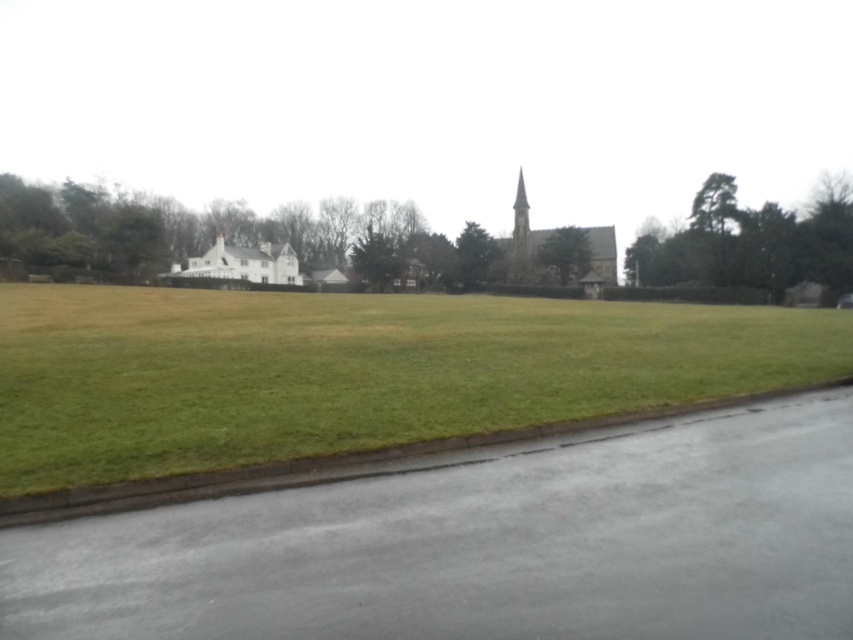
Is smooth stone church at center shorter than smooth stone spire at center?

No.

Consider the image. Is smooth stone church at center closer to the viewer compared to smooth stone spire at center?

Yes, it is in front of smooth stone spire at center.

Does point (515, 211) come behind point (517, 264)?

That is True.

Identify the location of smooth stone church at center. The image size is (853, 640). (521, 237).

Is green grass at center shorter than smooth stone spire at center?

Yes, green grass at center is shorter than smooth stone spire at center.

In the scene shown: Can you confirm if green grass at center is smaller than smooth stone spire at center?

Yes.

At what (x,y) coordinates should I click in order to perform the action: click on green grass at center. Please return your answer as a coordinate pair (x, y). Looking at the image, I should click on (352, 371).

Does green grass at center come in front of white matte house at center?

That is True.

Does green grass at center have a larger size compared to white matte house at center?

No.

What do you see at coordinates (352, 371) in the screenshot?
I see `green grass at center` at bounding box center [352, 371].

You are a GUI agent. You are given a task and a screenshot of the screen. Output one action in this format:
    pyautogui.click(x=<x>, y=<y>)
    Task: Click on the green grass at center
    
    Given the screenshot: What is the action you would take?
    pyautogui.click(x=352, y=371)